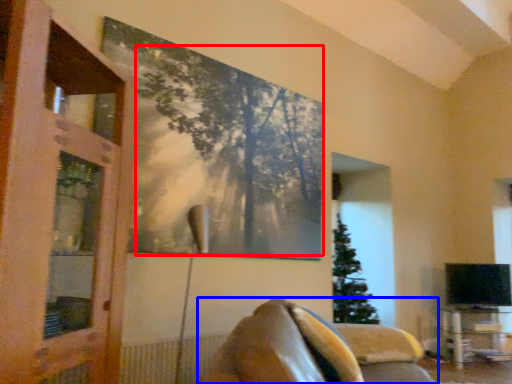
Question: Which object is further to the camera taking this photo, tree (highlighted by a red box) or furniture (highlighted by a blue box)?

Choices:
 (A) tree
 (B) furniture

Answer: (A)